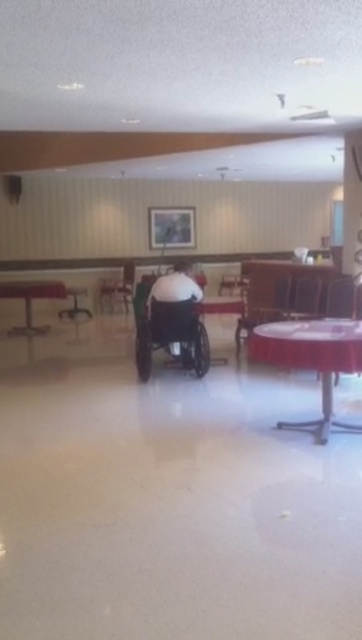
You are a maintenance worker in a nursing home and need to move a new rectangular sofa that is 1.5 meters wide into the communal area. The sofa must be placed between the red plastic table at center and the wooden chair at center. Can the sofa fit in the space between them?

The red plastic table at center is wider than the wooden chair at center. Since the sofa is 1.5 meters wide, it may not fit between them unless the distance between the table and chair is at least 1.5 meters. However, the provided information does not specify the distance between the two objects, so we cannot confirm if the sofa will fit based on the given details.

You are a maintenance worker in the facility and need to move a heavy object from the wooden chair at center to the metallic silver table at left. Considering their positions, can you place the object directly onto the table without adjusting their positions?

The wooden chair at center is located above the metallic silver table at left, so you cannot place the object directly onto the table without adjusting their positions because the chair is above the table.

You are a caregiver in a nursing home who needs to adjust the height of a chair so that a patient can sit comfortably. You have a wooden chair at center and a metallic silver table at left in the room. Which object should you adjust to ensure the patient can reach the table comfortably?

The wooden chair at center is taller than the metallic silver table at left. To ensure the patient can reach the table comfortably, you should lower the height of the wooden chair at center so that it aligns better with the table.